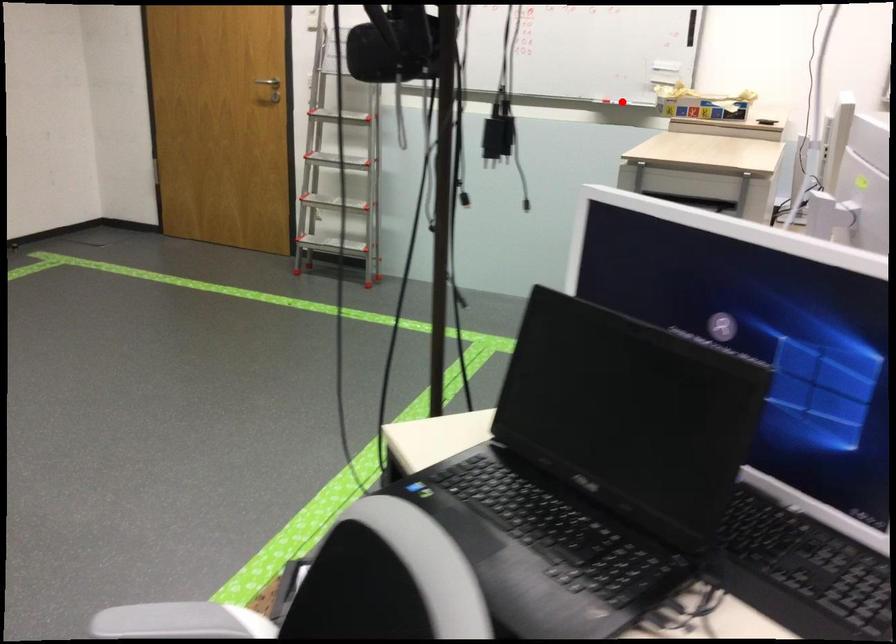
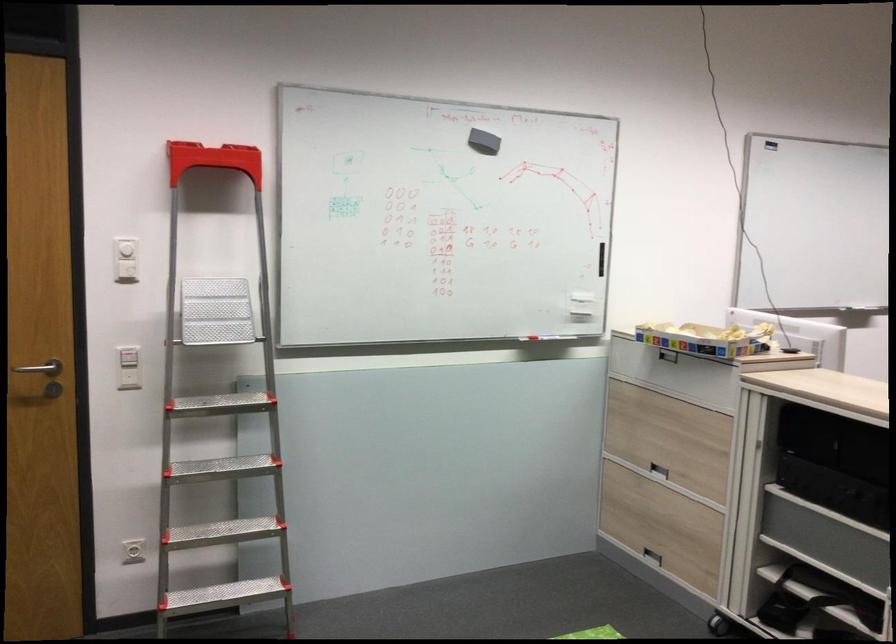
The point at the highlighted location is marked in the first image. Where is the corresponding point in the second image?

(539, 337)